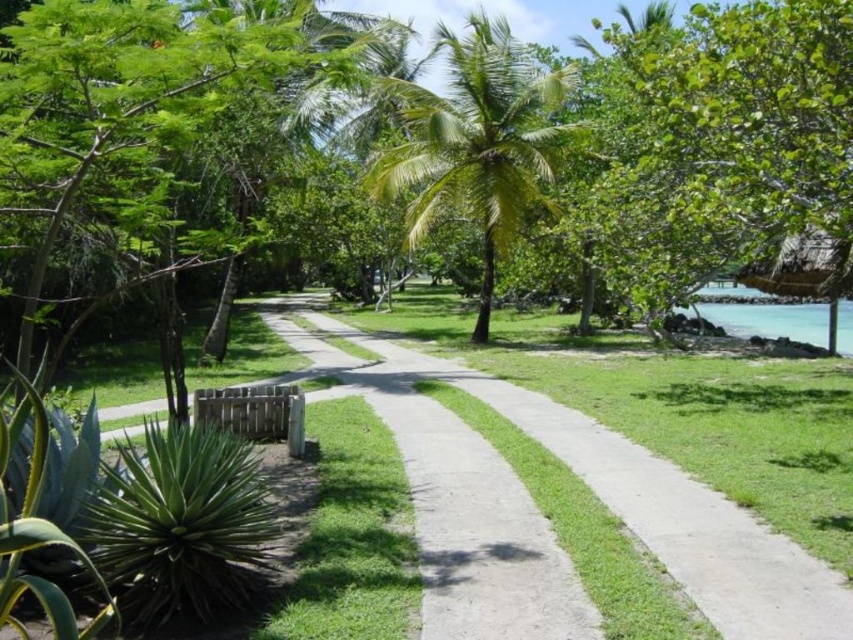
Who is shorter, gray concrete path at center or thatched roof hut at upper right?

Standing shorter between the two is thatched roof hut at upper right.

Is point (479, 378) more distant than point (828, 298)?

No.

Where is `gray concrete path at center`? The image size is (853, 640). gray concrete path at center is located at coordinates (579, 477).

Which is above, gray concrete path at center or green leafy palm tree at center?

Positioned higher is green leafy palm tree at center.

Can you confirm if gray concrete path at center is taller than green leafy palm tree at center?

Indeed, gray concrete path at center has a greater height compared to green leafy palm tree at center.

Describe the element at coordinates (579, 477) in the screenshot. I see `gray concrete path at center` at that location.

This screenshot has height=640, width=853. In order to click on gray concrete path at center in this screenshot , I will do `click(579, 477)`.

Is green leafy palm tree at center to the right of thatched roof hut at upper right from the viewer's perspective?

Incorrect, green leafy palm tree at center is not on the right side of thatched roof hut at upper right.

Which is above, green leafy palm tree at center or thatched roof hut at upper right?

green leafy palm tree at center

Who is more forward, (480, 324) or (811, 292)?

Point (811, 292) is more forward.

Identify the location of green leafy palm tree at center. (476, 141).